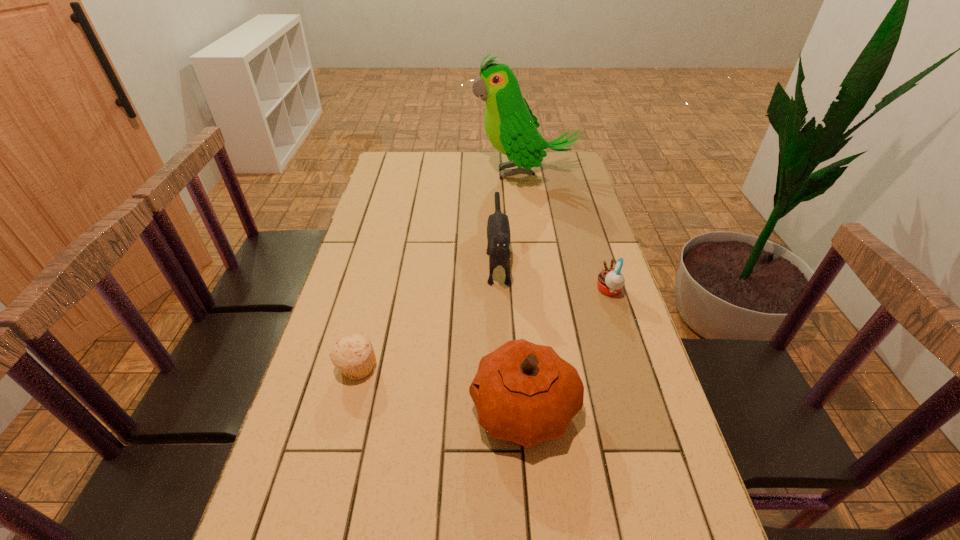
At what (x,y) coordinates should I click in order to perform the action: click on free space between the parakeet and the leftmost object. Please return your answer as a coordinate pair (x, y). Looking at the image, I should click on (441, 271).

You are a GUI agent. You are given a task and a screenshot of the screen. Output one action in this format:
    pyautogui.click(x=<x>, y=<y>)
    Task: Click on the vacant area that lies between the nearer muffin and the farther muffin
    
    Given the screenshot: What is the action you would take?
    pyautogui.click(x=483, y=329)

Find the location of a particular element. The width and height of the screenshot is (960, 540). unoccupied position between the pumpkin and the farthest object is located at coordinates (524, 291).

Where is `the fourth closest object to the nearer muffin`? This screenshot has width=960, height=540. the fourth closest object to the nearer muffin is located at coordinates (511, 127).

This screenshot has width=960, height=540. What are the coordinates of `object that is the third closest to the pumpkin` in the screenshot? It's located at (610, 282).